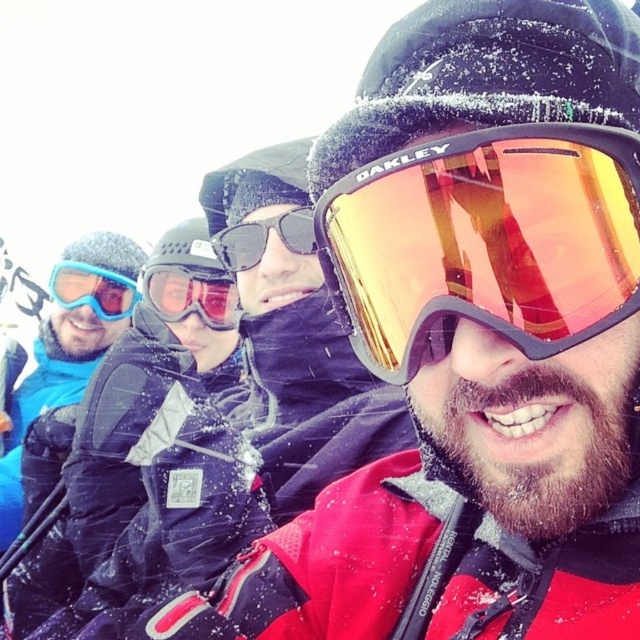
You are a photographer trying to capture a group photo of the gold reflective oakley goggles at center and the matte black sunglasses at center. The camera you have can only focus on objects within a 36 inch range. Will both items be in focus?

The gold reflective oakley goggles at center and matte black sunglasses at center are 38.86 inches apart, which exceeds the camera focus range of 36 inches. Therefore, both items cannot be in focus simultaneously.

You are standing at the center of the image and want to locate the gold reflective oakley goggles at center. According to the coordinates provided, in which direction should you look to find them?

The gold reflective oakley goggles at center are located at coordinates point [484,241]. Since the center of the image is typically at coordinates [320,320], the goggles are slightly to the left and below the center point. Therefore, you should look slightly to the left and downward from the center to locate them.